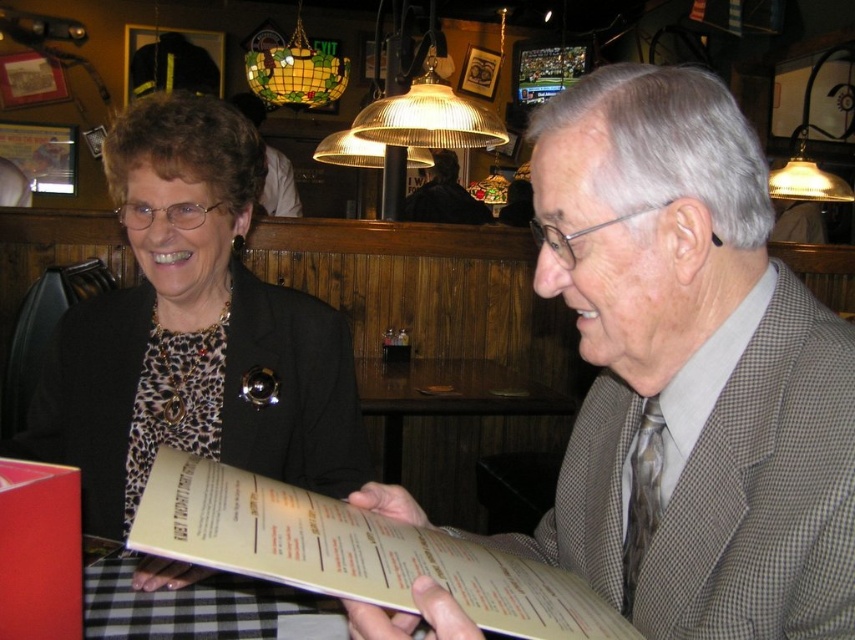
Does leopard print blouse at center appear over dark brown leather jacket at upper center?

Actually, leopard print blouse at center is below dark brown leather jacket at upper center.

Where is `leopard print blouse at center`? leopard print blouse at center is located at coordinates (193, 332).

Identify the location of leopard print blouse at center. The height and width of the screenshot is (640, 855). (193, 332).

Between beige paper menu at center and black checkered tablecloth at lower center, which one has less height?

black checkered tablecloth at lower center

Does beige paper menu at center have a lesser width compared to black checkered tablecloth at lower center?

No.

Who is more distant from viewer, (557, 586) or (87, 608)?

Point (87, 608)

Where is `beige paper menu at center`? The width and height of the screenshot is (855, 640). beige paper menu at center is located at coordinates (352, 552).

Is point (556, 612) positioned after point (439, 166)?

No, (556, 612) is closer to viewer.

Which is behind, point (205, 470) or point (439, 212)?

The point (439, 212) is more distant.

Is point (273, 500) positioned behind point (445, 205)?

No, (273, 500) is in front of (445, 205).

I want to click on beige paper menu at center, so click(x=352, y=552).